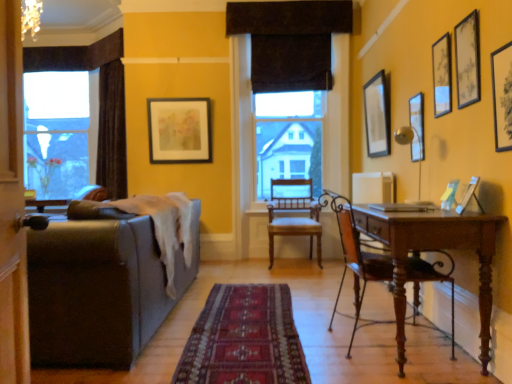
The image size is (512, 384). I want to click on vacant point to the right of carpeted rug at center, so click(x=357, y=321).